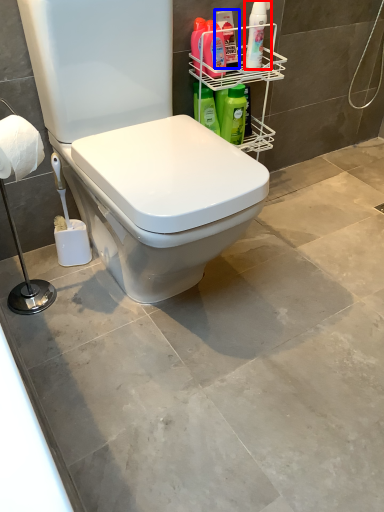
Question: Which of the following is the farthest to the observer, cleaning product (highlighted by a red box) or cleaning product (highlighted by a blue box)?

Choices:
 (A) cleaning product
 (B) cleaning product

Answer: (B)